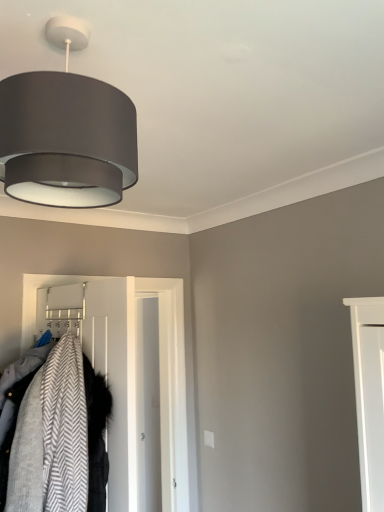
Question: From the image's perspective, is white smooth door at center on gray herringbone fabric coat at left?

Choices:
 (A) yes
 (B) no

Answer: (B)

Question: Does white smooth door at center have a lesser width compared to gray herringbone fabric coat at left?

Choices:
 (A) yes
 (B) no

Answer: (A)

Question: Is white smooth door at center completely or partially outside of gray herringbone fabric coat at left?

Choices:
 (A) yes
 (B) no

Answer: (A)

Question: Is white smooth door at center taller than gray herringbone fabric coat at left?

Choices:
 (A) no
 (B) yes

Answer: (B)

Question: Can you confirm if white smooth door at center is shorter than gray herringbone fabric coat at left?

Choices:
 (A) no
 (B) yes

Answer: (A)

Question: Considering the relative sizes of white smooth door at center and gray herringbone fabric coat at left in the image provided, is white smooth door at center smaller than gray herringbone fabric coat at left?

Choices:
 (A) yes
 (B) no

Answer: (B)

Question: Is white smooth door at center located within gray herringbone fabric coat at left?

Choices:
 (A) no
 (B) yes

Answer: (A)

Question: Is gray herringbone fabric coat at left facing towards white smooth door at center?

Choices:
 (A) no
 (B) yes

Answer: (A)

Question: From the image's perspective, is gray herringbone fabric coat at left beneath white smooth door at center?

Choices:
 (A) no
 (B) yes

Answer: (A)

Question: Considering the relative sizes of gray herringbone fabric coat at left and white smooth door at center in the image provided, is gray herringbone fabric coat at left bigger than white smooth door at center?

Choices:
 (A) yes
 (B) no

Answer: (B)

Question: Is gray herringbone fabric coat at left thinner than white smooth door at center?

Choices:
 (A) no
 (B) yes

Answer: (A)

Question: From the image's perspective, is gray herringbone fabric coat at left located above white smooth door at center?

Choices:
 (A) yes
 (B) no

Answer: (A)

Question: Considering the relative sizes of gray herringbone fabric coat at left and matte gray fabric lampshade at upper left in the image provided, is gray herringbone fabric coat at left wider than matte gray fabric lampshade at upper left?

Choices:
 (A) no
 (B) yes

Answer: (B)